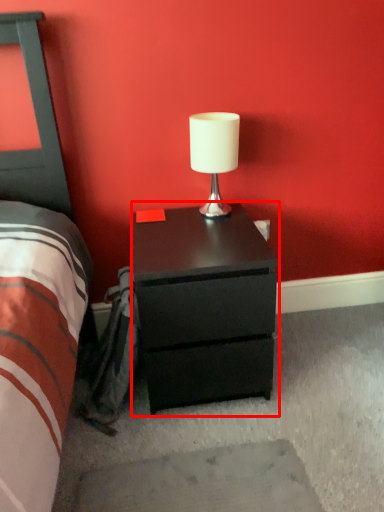
Question: From the image, what is the correct spatial relationship of nightstand (annotated by the red box) in relation to table lamp?

Choices:
 (A) left
 (B) right

Answer: (A)